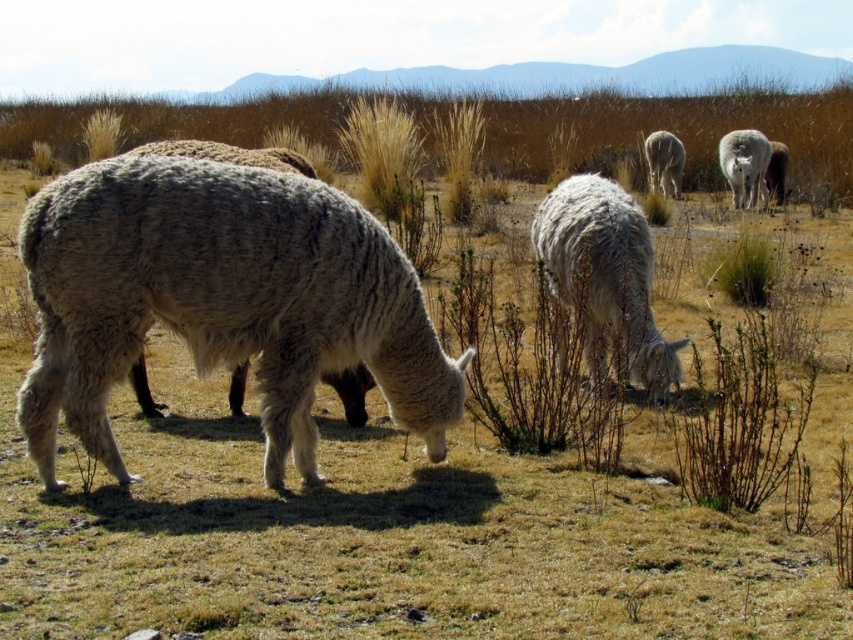
Between white woolen alpaca at left and white woolen sheep at center, which one is positioned higher?

white woolen sheep at center is above.

Is white woolen alpaca at left behind white woolen sheep at center?

No, white woolen alpaca at left is in front of white woolen sheep at center.

Which is behind, point (289, 394) or point (664, 134)?

The point (664, 134) is more distant.

Identify the location of white woolen alpaca at left. This screenshot has width=853, height=640. (221, 301).

What do you see at coordinates (607, 272) in the screenshot? I see `white woolen alpaca at center` at bounding box center [607, 272].

Does white woolen alpaca at center appear on the left side of white woolen alpaca at upper right?

Yes, white woolen alpaca at center is to the left of white woolen alpaca at upper right.

Measure the distance between point [631,230] and camera.

They are 5.41 meters apart.

The width and height of the screenshot is (853, 640). I want to click on white woolen alpaca at center, so click(x=607, y=272).

Find the location of a particular element. The image size is (853, 640). white woolen alpaca at left is located at coordinates (221, 301).

Can you confirm if white woolen alpaca at left is smaller than white woolen alpaca at upper right?

Correct, white woolen alpaca at left occupies less space than white woolen alpaca at upper right.

The height and width of the screenshot is (640, 853). Find the location of `white woolen alpaca at left`. white woolen alpaca at left is located at coordinates (221, 301).